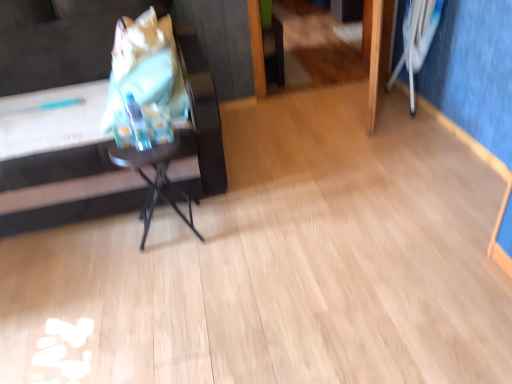
Identify the location of vacant space situated on the left part of metallic black table at center. (115, 243).